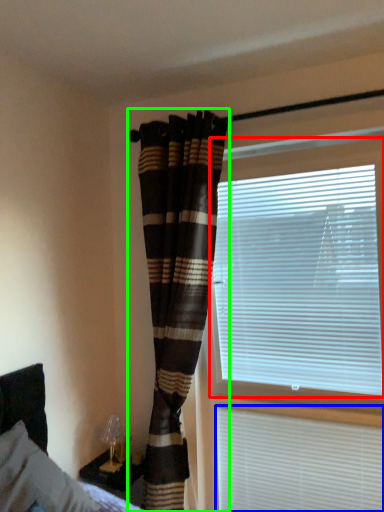
Question: Based on their relative distances, which object is nearer to window blind (highlighted by a red box)? Choose from window blind (highlighted by a blue box) and curtain (highlighted by a green box).

Choices:
 (A) window blind
 (B) curtain

Answer: (B)